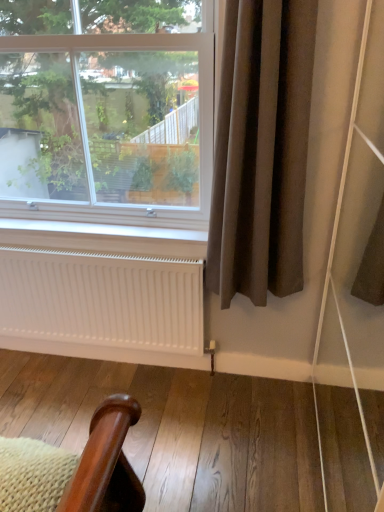
At what (x,y) coordinates should I click in order to perform the action: click on free spot below brown fabric curtain at right (from a real-world perspective). Please return your answer as a coordinate pair (x, y). Looking at the image, I should click on (239, 391).